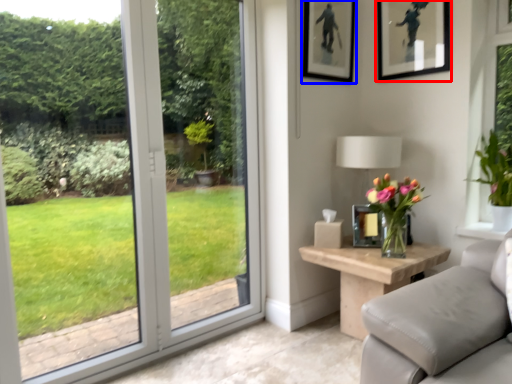
Question: Which point is further to the camera, picture frame (highlighted by a red box) or picture frame (highlighted by a blue box)?

Choices:
 (A) picture frame
 (B) picture frame

Answer: (B)